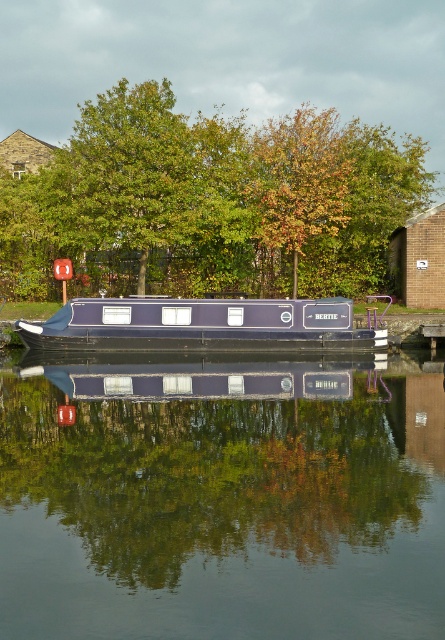
Which is more to the left, glossy dark blue boat at center or green leafy tree at center?

Positioned to the left is green leafy tree at center.

Is glossy dark blue boat at center shorter than green leafy tree at center?

Yes.

Is point (397, 595) in front of point (23, 241)?

That is True.

The width and height of the screenshot is (445, 640). Find the location of `glossy dark blue boat at center`. glossy dark blue boat at center is located at coordinates (222, 500).

Who is higher up, green leafy tree at center or matte blue barge at center?

green leafy tree at center is above.

Who is positioned more to the right, green leafy tree at center or matte blue barge at center?

matte blue barge at center

Which is in front, point (137, 208) or point (88, 333)?

Point (88, 333) is in front.

This screenshot has width=445, height=640. I want to click on green leafy tree at center, so click(x=210, y=200).

Does glossy dark blue boat at center appear over matte blue barge at center?

No, glossy dark blue boat at center is not above matte blue barge at center.

Does glossy dark blue boat at center have a smaller size compared to matte blue barge at center?

No, glossy dark blue boat at center is not smaller than matte blue barge at center.

Where is `glossy dark blue boat at center`? The image size is (445, 640). glossy dark blue boat at center is located at coordinates (222, 500).

Locate an element on the screen. glossy dark blue boat at center is located at coordinates (222, 500).